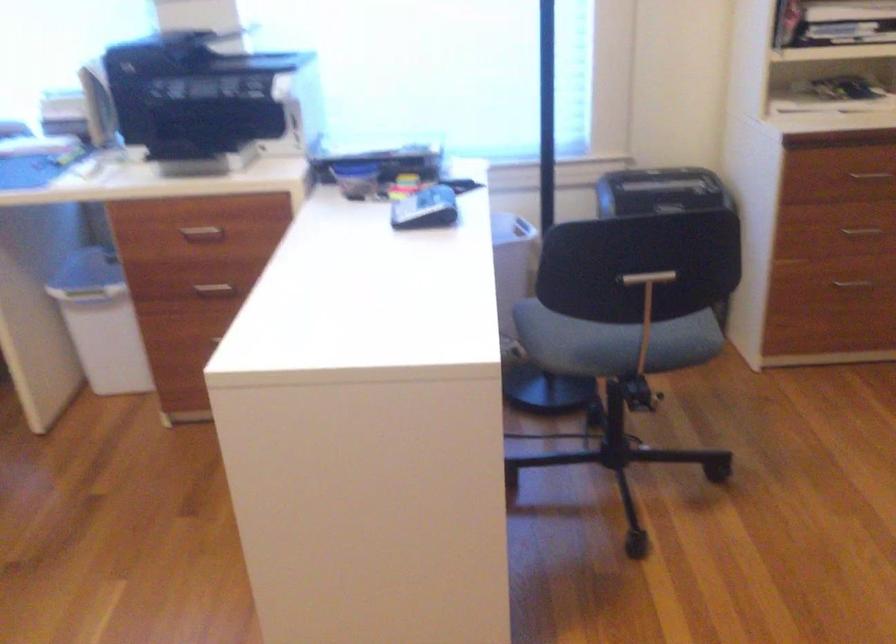
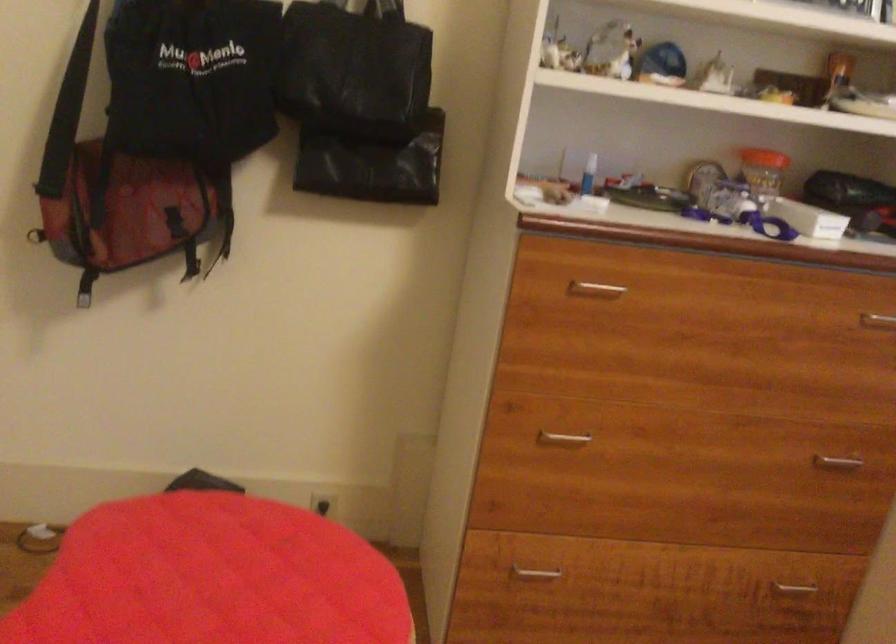
Question: The first image is from the beginning of the video and the second image is from the end. How did the camera likely rotate when shooting the video?

Choices:
 (A) Left
 (B) Right
 (C) Up
 (D) Down

Answer: (A)